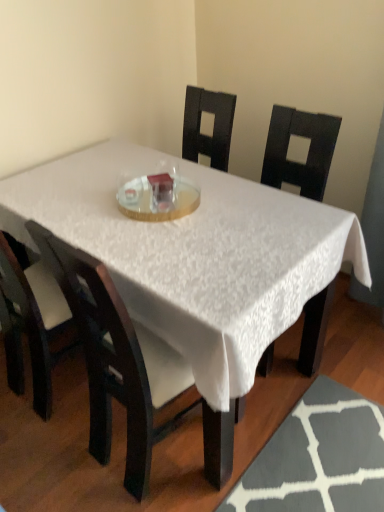
Locate an element on the screen. The height and width of the screenshot is (512, 384). vacant position to the left of clear glass plate at center is located at coordinates (81, 201).